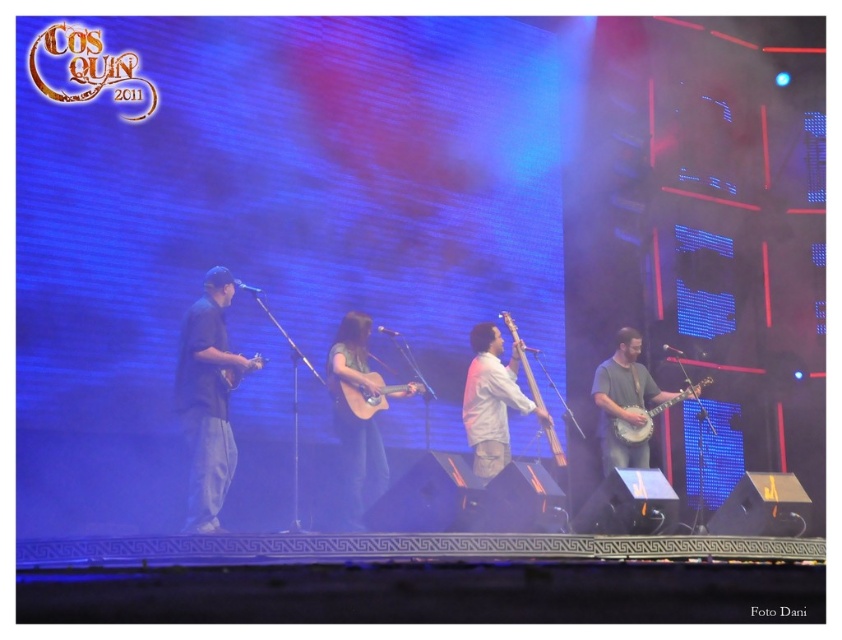
Is light brown acoustic guitar at center bigger than wooden acoustic guitar at center?

Yes.

Between light brown acoustic guitar at center and wooden acoustic guitar at center, which one appears on the right side from the viewer's perspective?

light brown acoustic guitar at center is more to the right.

What do you see at coordinates (368, 394) in the screenshot? I see `light brown acoustic guitar at center` at bounding box center [368, 394].

Locate an element on the screen. This screenshot has height=640, width=842. light brown acoustic guitar at center is located at coordinates (368, 394).

Does matte brown banjo at center have a lesser width compared to light brown acoustic guitar at center?

Incorrect, matte brown banjo at center's width is not less than light brown acoustic guitar at center's.

Between point (632, 445) and point (364, 406), which one is positioned in front?

Point (364, 406) is more forward.

Between point (595, 392) and point (353, 401), which one is positioned behind?

The point (595, 392) is more distant.

At what (x,y) coordinates should I click in order to perform the action: click on matte brown banjo at center. Please return your answer as a coordinate pair (x, y). This screenshot has height=640, width=842. Looking at the image, I should click on (624, 401).

Does matte brown banjo at right appear over matte wood guitar at center?

No, matte brown banjo at right is not above matte wood guitar at center.

Find the location of a particular element. Image resolution: width=842 pixels, height=640 pixels. matte brown banjo at right is located at coordinates (649, 416).